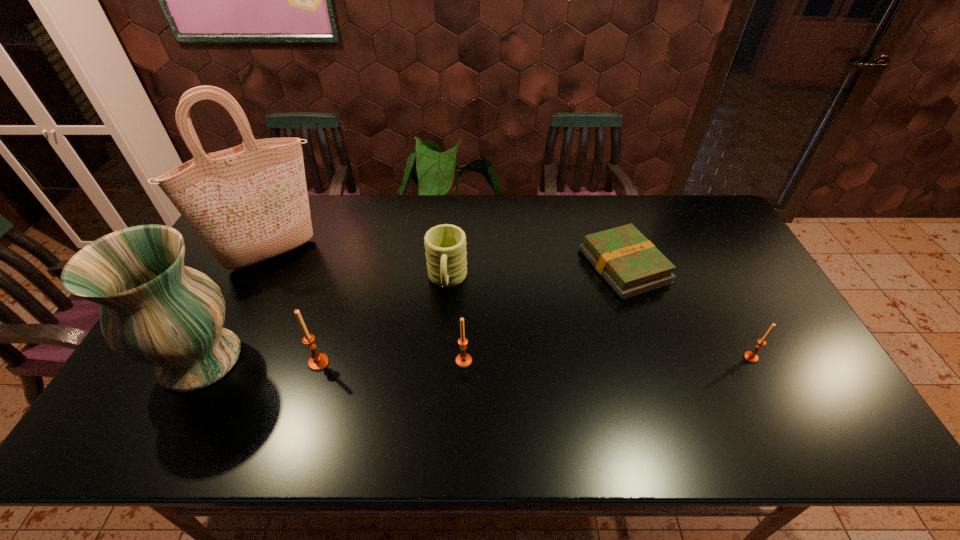
Where is `vase present at the left edge`? The height and width of the screenshot is (540, 960). vase present at the left edge is located at coordinates (155, 311).

The width and height of the screenshot is (960, 540). I want to click on object at the right edge, so click(751, 356).

Identify the location of object that is at the far left corner. (249, 203).

Find the location of a particular element. Image resolution: width=960 pixels, height=540 pixels. object that is positioned at the near left corner is located at coordinates tap(155, 311).

In the image, there is a desktop. Where is `blank space at the far edge`? Image resolution: width=960 pixels, height=540 pixels. blank space at the far edge is located at coordinates (356, 209).

Image resolution: width=960 pixels, height=540 pixels. I want to click on free space at the near edge of the desktop, so click(463, 391).

Locate an element on the screen. The image size is (960, 540). vacant region at the far right corner of the desktop is located at coordinates (720, 236).

I want to click on free space between the vase and the shortest candle_holder, so click(476, 359).

Locate an element on the screen. This screenshot has height=540, width=960. vacant area that lies between the second candle_holder from left to right and the book is located at coordinates (543, 314).

Find the location of a particular element. vacant space that is in between the shopping bag and the tallest candle_holder is located at coordinates (296, 308).